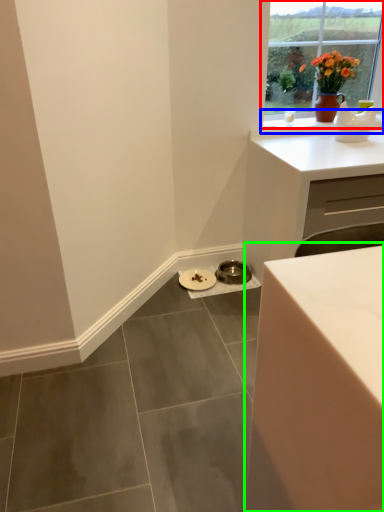
Question: Estimate the real-world distances between objects in this image. Which object is farther from window (highlighted by a red box), window sill (highlighted by a blue box) or table (highlighted by a green box)?

Choices:
 (A) window sill
 (B) table

Answer: (B)